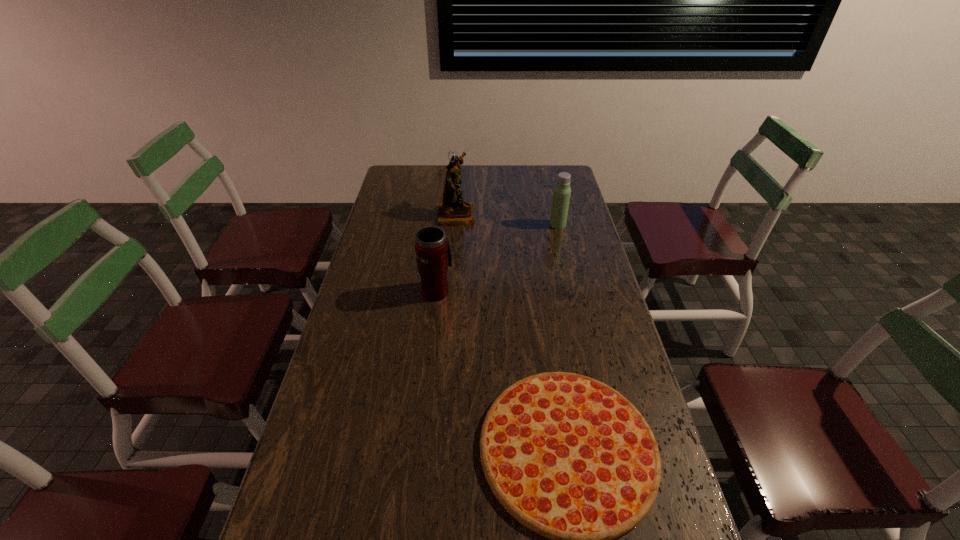
At what (x,y) coordinates should I click in order to perform the action: click on free space at the far edge of the desktop. Please return your answer as a coordinate pair (x, y). The image size is (960, 540). Looking at the image, I should click on (474, 174).

Where is `free space at the left edge`? The height and width of the screenshot is (540, 960). free space at the left edge is located at coordinates (283, 503).

Identify the location of vacant area at the right edge of the desktop. This screenshot has width=960, height=540. (578, 253).

Where is `vacant region at the far left corner of the desktop`? The image size is (960, 540). vacant region at the far left corner of the desktop is located at coordinates (405, 168).

The height and width of the screenshot is (540, 960). Find the location of `free space at the far right corner of the desktop`. free space at the far right corner of the desktop is located at coordinates (560, 173).

In order to click on vacant space that is in between the right thermos bottle and the second nearest object in this screenshot , I will do `click(497, 258)`.

You are a GUI agent. You are given a task and a screenshot of the screen. Output one action in this format:
    pyautogui.click(x=<x>, y=<y>)
    Task: Click on the vacant area between the figurine and the right thermos bottle
    
    Given the screenshot: What is the action you would take?
    pyautogui.click(x=507, y=220)

I want to click on free space between the right thermos bottle and the figurine, so click(507, 220).

Locate an element on the screen. The width and height of the screenshot is (960, 540). empty space that is in between the figurine and the farther thermos bottle is located at coordinates (507, 220).

Select which object is the second closest to the farther thermos bottle. Please provide its 2D coordinates. Your answer should be formatted as a tuple, i.e. [(x, y)], where the tuple contains the x and y coordinates of a point satisfying the conditions above.

[(433, 251)]